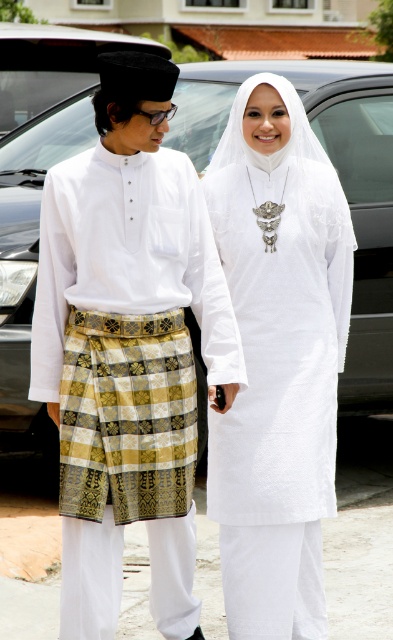
Is the position of white woven kain at left less distant than that of white matte dress at center?

Yes, white woven kain at left is in front of white matte dress at center.

Is white woven kain at left thinner than white matte dress at center?

In fact, white woven kain at left might be wider than white matte dress at center.

The width and height of the screenshot is (393, 640). Identify the location of white woven kain at left. pos(128,348).

Which is behind, point (185, 564) or point (55, 442)?

Point (55, 442)

Can you confirm if white woven kain at left is positioned to the left of metallic gray car at center?

Correct, you'll find white woven kain at left to the left of metallic gray car at center.

What do you see at coordinates (128, 348) in the screenshot? Image resolution: width=393 pixels, height=640 pixels. I see `white woven kain at left` at bounding box center [128, 348].

What are the coordinates of `white woven kain at left` in the screenshot? It's located at (128, 348).

Locate an element on the screen. white matte dress at center is located at coordinates (277, 358).

Between white matte dress at center and metallic gray car at center, which one has more height?

Standing taller between the two is white matte dress at center.

The image size is (393, 640). Describe the element at coordinates (277, 358) in the screenshot. I see `white matte dress at center` at that location.

Locate an element on the screen. white matte dress at center is located at coordinates (277, 358).